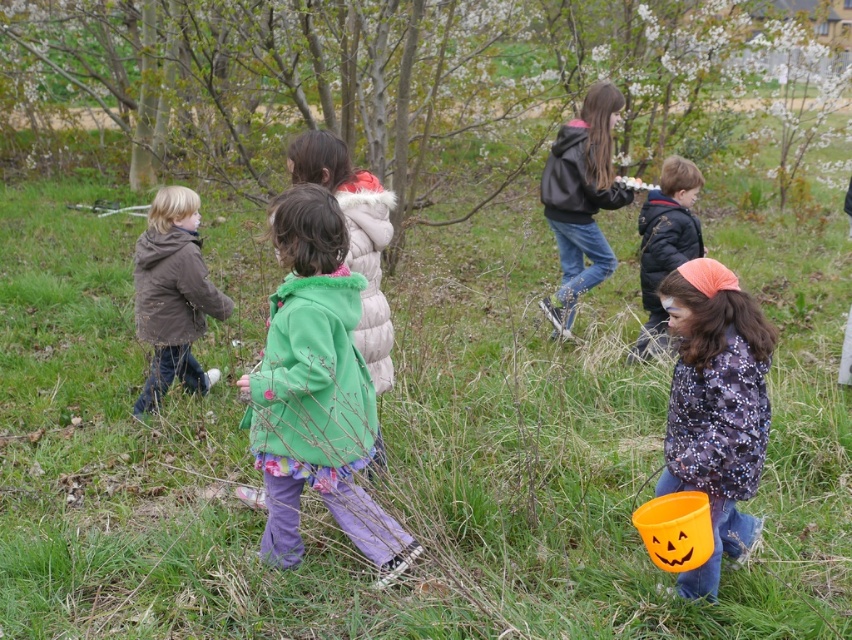
Is orange fabric bucket at lower right behind brown matte jacket at left?

No.

Does point (704, 326) lie in front of point (151, 333)?

Yes, it is.

Which is behind, point (735, 298) or point (204, 316)?

Positioned behind is point (204, 316).

Locate an element on the screen. orange fabric bucket at lower right is located at coordinates (715, 406).

Is green fuzzy coat at center thinner than brown matte jacket at left?

In fact, green fuzzy coat at center might be wider than brown matte jacket at left.

Which is more to the left, green fuzzy coat at center or brown matte jacket at left?

brown matte jacket at left is more to the left.

Measure the distance between green fuzzy coat at center and camera.

3.29 meters

This screenshot has width=852, height=640. In order to click on green fuzzy coat at center in this screenshot , I will do `click(315, 390)`.

Can you confirm if brown matte jacket at left is smaller than matte black jacket at center?

Yes.

This screenshot has height=640, width=852. What do you see at coordinates (173, 296) in the screenshot?
I see `brown matte jacket at left` at bounding box center [173, 296].

Image resolution: width=852 pixels, height=640 pixels. I want to click on brown matte jacket at left, so click(173, 296).